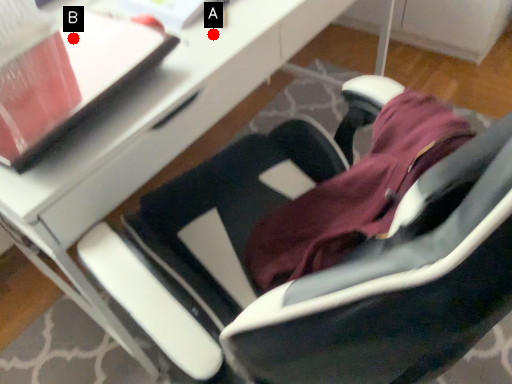
Question: Two points are circled on the image, labeled by A and B beside each circle. Which point is further to the camera?

Choices:
 (A) A is further
 (B) B is further

Answer: (A)